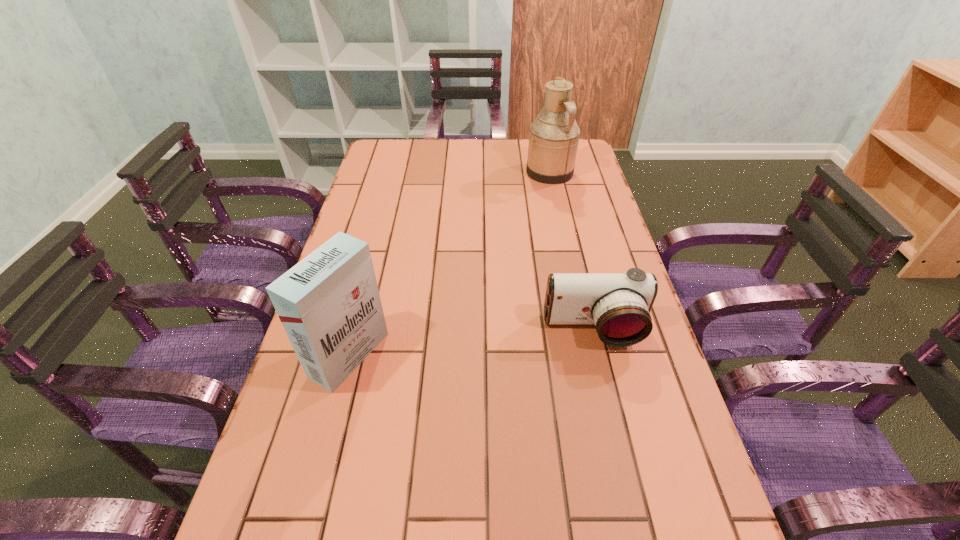
Identify the location of pitcher that is at the right edge. The image size is (960, 540). (554, 134).

Locate an element on the screen. The image size is (960, 540). camcorder that is at the right edge is located at coordinates (619, 304).

In order to click on object at the far right corner in this screenshot , I will do `click(554, 134)`.

This screenshot has height=540, width=960. In the image, there is a desktop. Find the location of `vacant space at the far edge`. vacant space at the far edge is located at coordinates (502, 158).

This screenshot has width=960, height=540. Identify the location of free location at the left edge of the desktop. (329, 403).

Locate an element on the screen. This screenshot has width=960, height=540. vacant space at the right edge is located at coordinates (591, 264).

In the image, there is a desktop. In order to click on free space at the far left corner in this screenshot , I will do `click(397, 164)`.

Find the location of a particular element. This screenshot has height=540, width=960. free space between the camcorder and the farthest object is located at coordinates (572, 251).

I want to click on unoccupied position between the farthest object and the cigarette case, so click(x=449, y=264).

Identify the location of vacant space that is in between the second tallest object and the camcorder. 471,342.